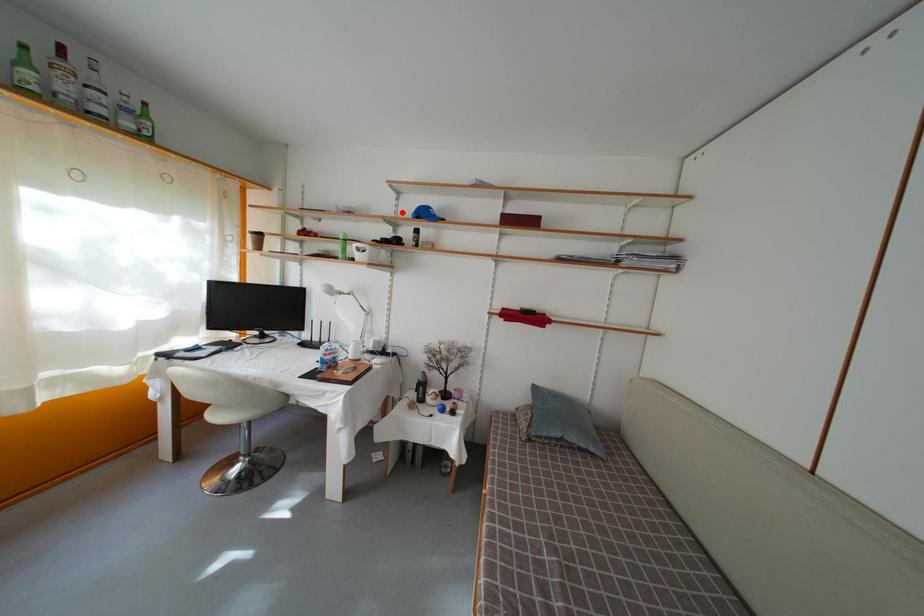
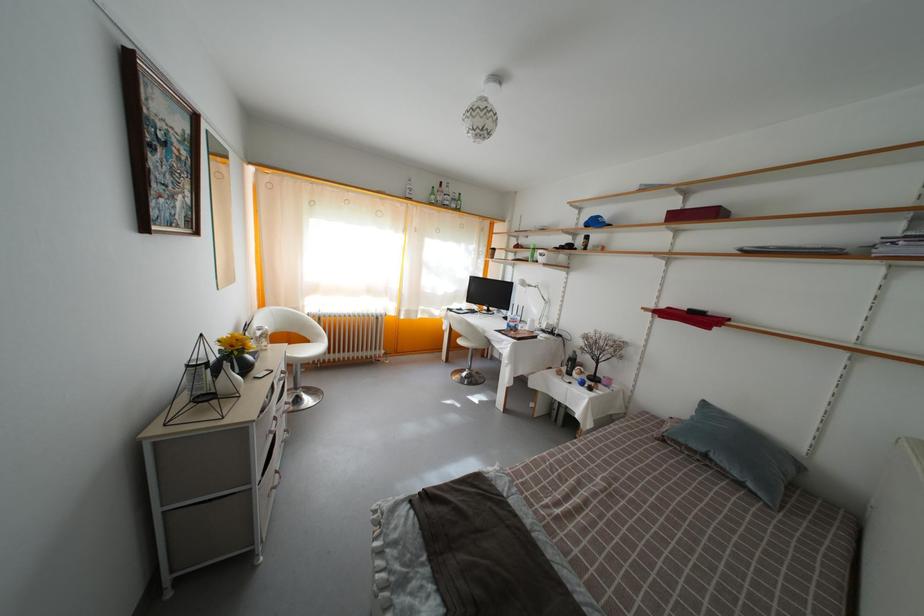
Find the pixel in the second image that matches the highlighted location in the first image.

(584, 225)